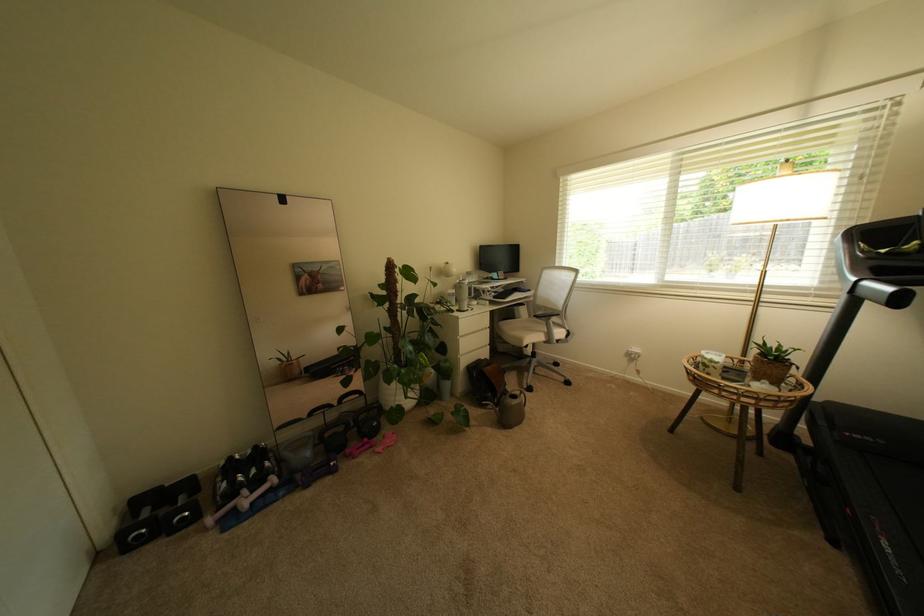
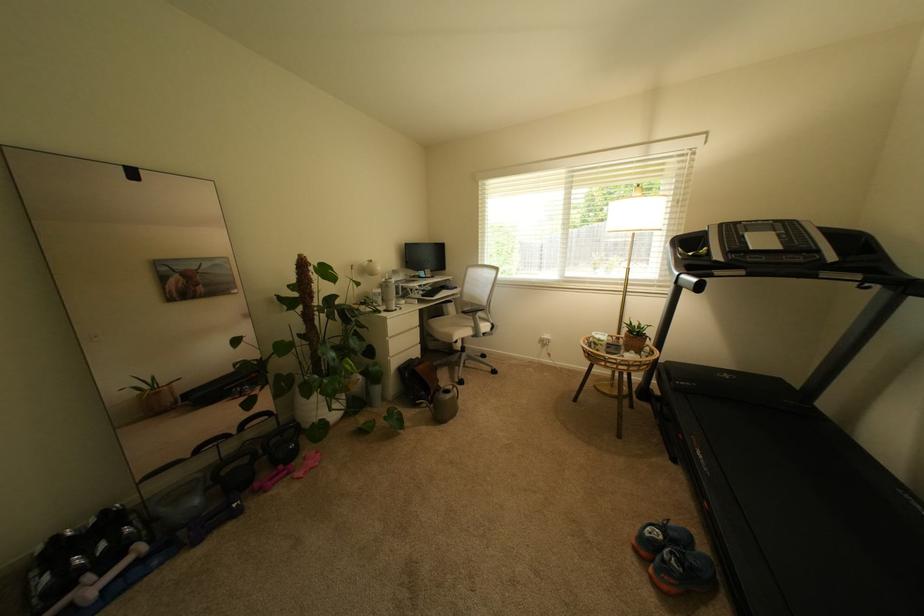
Find the pixel in the second image that matches the point at 869,292 in the first image.

(688, 283)